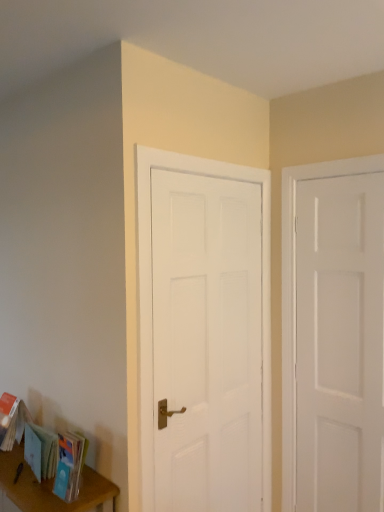
Question: Are light blue paper book at lower left and white matte door at center, positioned as the 2th door in right-to-left order, making contact?

Choices:
 (A) yes
 (B) no

Answer: (B)

Question: Is light blue paper book at lower left facing away from white matte door at center, which appears as the first door when viewed from the left?

Choices:
 (A) yes
 (B) no

Answer: (A)

Question: Is light blue paper book at lower left outside white matte door at center, positioned as the 2th door in right-to-left order?

Choices:
 (A) yes
 (B) no

Answer: (A)

Question: Is light blue paper book at lower left oriented towards white matte door at center, positioned as the 2th door in right-to-left order?

Choices:
 (A) yes
 (B) no

Answer: (B)

Question: Is light blue paper book at lower left surrounding white matte door at center, positioned as the 2th door in right-to-left order?

Choices:
 (A) no
 (B) yes

Answer: (A)

Question: Is the depth of light blue paper book at lower left less than that of white matte door at center, positioned as the 2th door in right-to-left order?

Choices:
 (A) yes
 (B) no

Answer: (B)

Question: Is wooden table at lower left positioned in front of white matte door at right, the 2th door in the left-to-right sequence?

Choices:
 (A) yes
 (B) no

Answer: (A)

Question: Is wooden table at lower left next to white matte door at right, the first door positioned from the right?

Choices:
 (A) no
 (B) yes

Answer: (A)

Question: Is wooden table at lower left facing towards white matte door at right, the first door positioned from the right?

Choices:
 (A) yes
 (B) no

Answer: (B)

Question: Is wooden table at lower left bigger than white matte door at right, the 2th door in the left-to-right sequence?

Choices:
 (A) no
 (B) yes

Answer: (B)

Question: Would you say wooden table at lower left contains white matte door at right, the 2th door in the left-to-right sequence?

Choices:
 (A) yes
 (B) no

Answer: (B)

Question: Can you confirm if wooden table at lower left is wider than white matte door at right, the first door positioned from the right?

Choices:
 (A) no
 (B) yes

Answer: (B)

Question: Is white matte door at center, positioned as the 2th door in right-to-left order, shorter than light blue paper book at lower left?

Choices:
 (A) no
 (B) yes

Answer: (A)